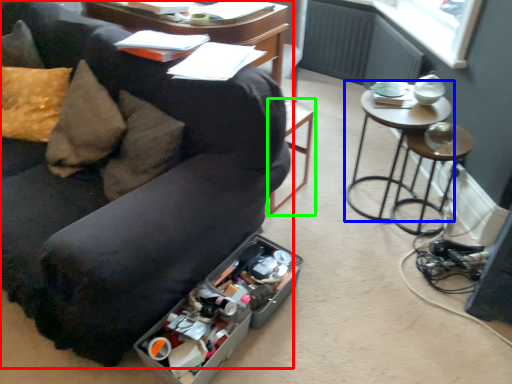
Question: Estimate the real-world distances between objects in this image. Which object is farther from studio couch (highlighted by a red box), table (highlighted by a blue box) or bar stool (highlighted by a green box)?

Choices:
 (A) table
 (B) bar stool

Answer: (A)